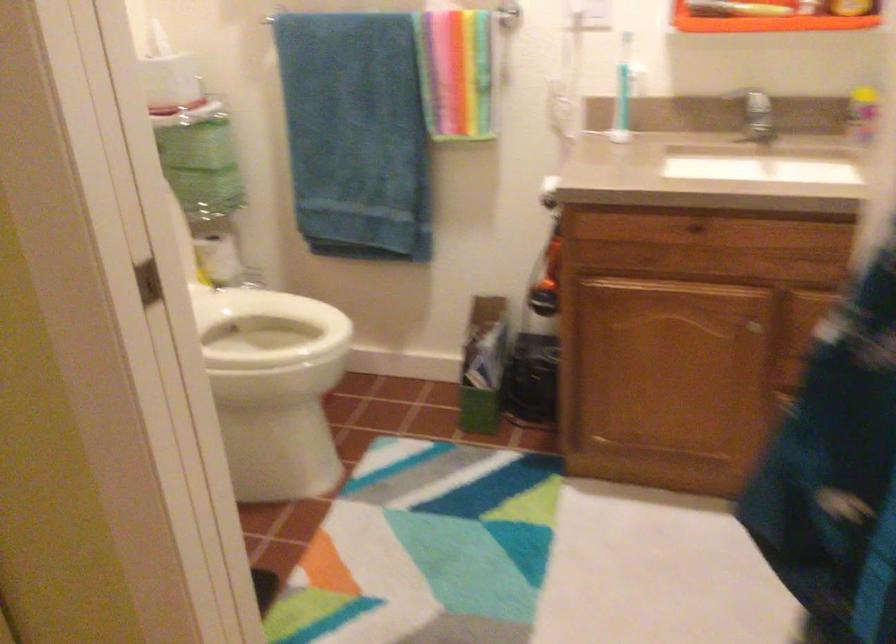
Where would you lift the blue toothbrush? Please return your answer as a coordinate pair (x, y).

(623, 91)